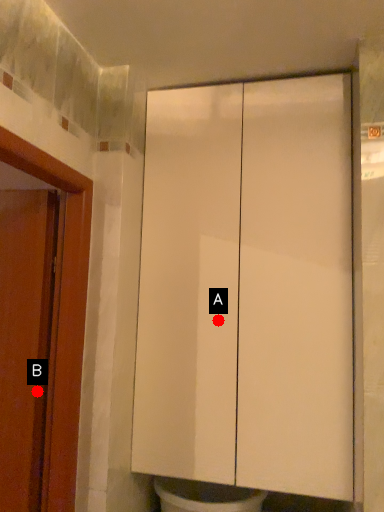
Question: Two points are circled on the image, labeled by A and B beside each circle. Which point appears farthest from the camera in this image?

Choices:
 (A) A is further
 (B) B is further

Answer: (A)